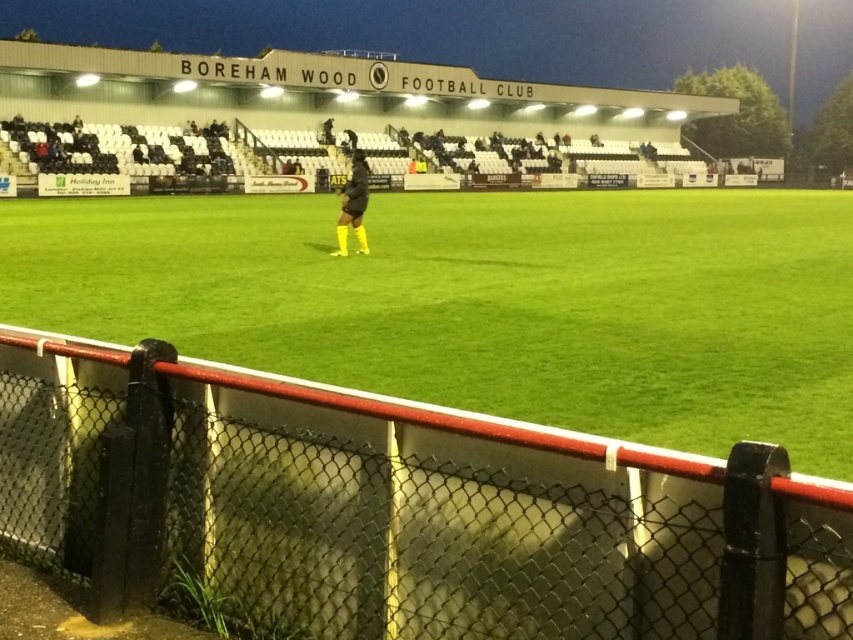
Between black chain-link fence at center and matte black jacket at center, which one appears on the left side from the viewer's perspective?

From the viewer's perspective, matte black jacket at center appears more on the left side.

Between point (33, 381) and point (337, 220), which one is positioned behind?

Point (337, 220)

I want to click on black chain-link fence at center, so click(398, 509).